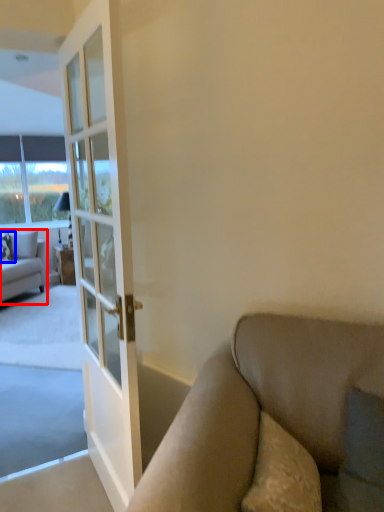
Question: Which of the following is the farthest to the observer, studio couch (highlighted by a red box) or pillow (highlighted by a blue box)?

Choices:
 (A) studio couch
 (B) pillow

Answer: (B)